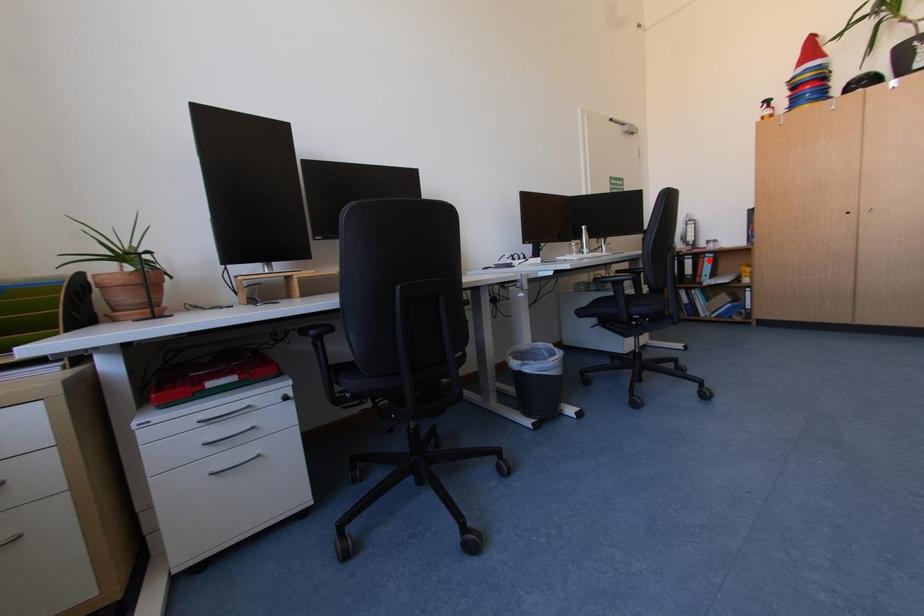
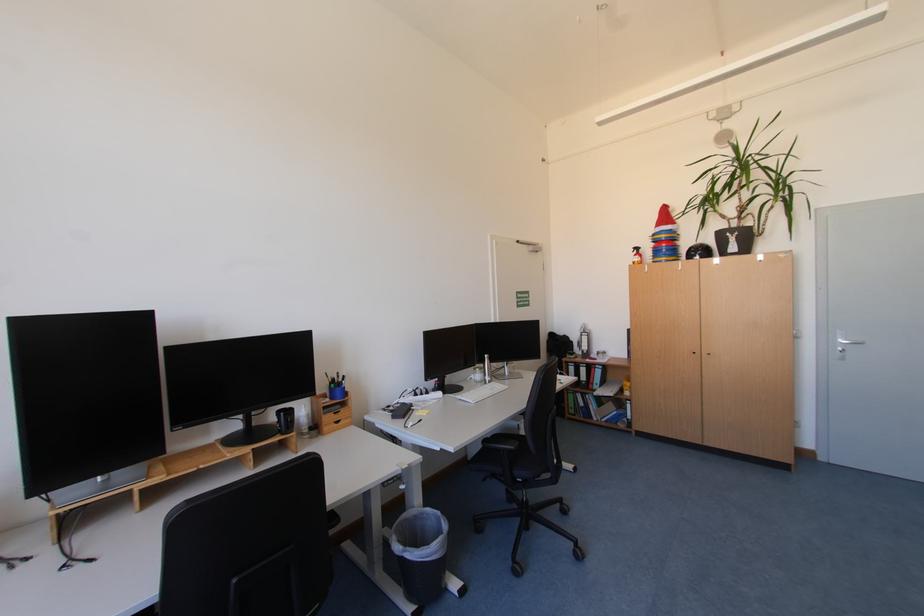
Question: I am providing you with two images of the same scene from different viewpoints. Given a red point in image1, look at the same physical point in image2. Is it:

Choices:
 (A) Closer to the viewpoint
 (B) Farther from the viewpoint

Answer: (B)